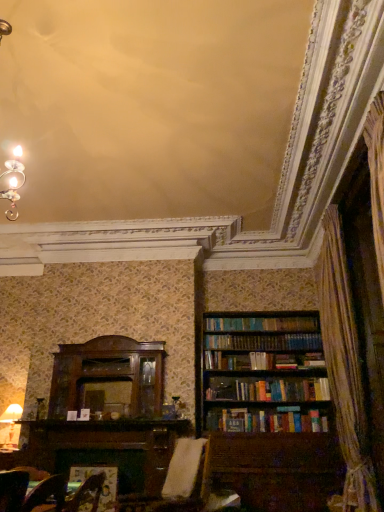
Question: Is white fabric swivel chair at center bigger than brown wooden bookcase at right?

Choices:
 (A) yes
 (B) no

Answer: (B)

Question: From a real-world perspective, is white fabric swivel chair at center beneath brown wooden bookcase at right?

Choices:
 (A) no
 (B) yes

Answer: (B)

Question: Is white fabric swivel chair at center directly adjacent to brown wooden bookcase at right?

Choices:
 (A) yes
 (B) no

Answer: (B)

Question: Is brown wooden bookcase at right located within white fabric swivel chair at center?

Choices:
 (A) yes
 (B) no

Answer: (B)

Question: From the image's perspective, is white fabric swivel chair at center over brown wooden bookcase at right?

Choices:
 (A) yes
 (B) no

Answer: (B)

Question: Visually, is velvet brown armchair at lower center positioned to the left or to the right of brown wooden bookcase at right?

Choices:
 (A) right
 (B) left

Answer: (B)

Question: Which is correct: velvet brown armchair at lower center is inside brown wooden bookcase at right, or outside of it?

Choices:
 (A) inside
 (B) outside

Answer: (B)

Question: Considering their positions, is velvet brown armchair at lower center located in front of or behind brown wooden bookcase at right?

Choices:
 (A) front
 (B) behind

Answer: (A)

Question: Considering the positions of velvet brown armchair at lower center and brown wooden bookcase at right in the image, is velvet brown armchair at lower center bigger or smaller than brown wooden bookcase at right?

Choices:
 (A) big
 (B) small

Answer: (B)

Question: Is matte white lampshade at lower left taller or shorter than brown wooden bookcase at right?

Choices:
 (A) short
 (B) tall

Answer: (A)

Question: Is matte white lampshade at lower left bigger or smaller than brown wooden bookcase at right?

Choices:
 (A) big
 (B) small

Answer: (B)

Question: Is point (16, 411) closer or farther from the camera than point (246, 357)?

Choices:
 (A) farther
 (B) closer

Answer: (B)

Question: Is matte white lampshade at lower left spatially inside brown wooden bookcase at right, or outside of it?

Choices:
 (A) inside
 (B) outside

Answer: (B)

Question: From the image's perspective, relative to brown wooden bookcase at right, is white fabric swivel chair at center above or below?

Choices:
 (A) above
 (B) below

Answer: (B)

Question: Based on their positions, is white fabric swivel chair at center located to the left or right of brown wooden bookcase at right?

Choices:
 (A) right
 (B) left

Answer: (B)